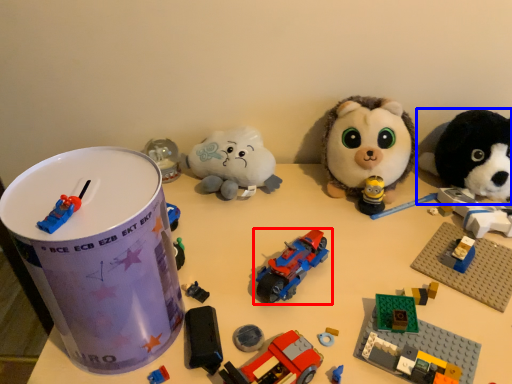
Question: Which point is closer to the camera, toy (highlighted by a red box) or toy (highlighted by a blue box)?

Choices:
 (A) toy
 (B) toy

Answer: (A)